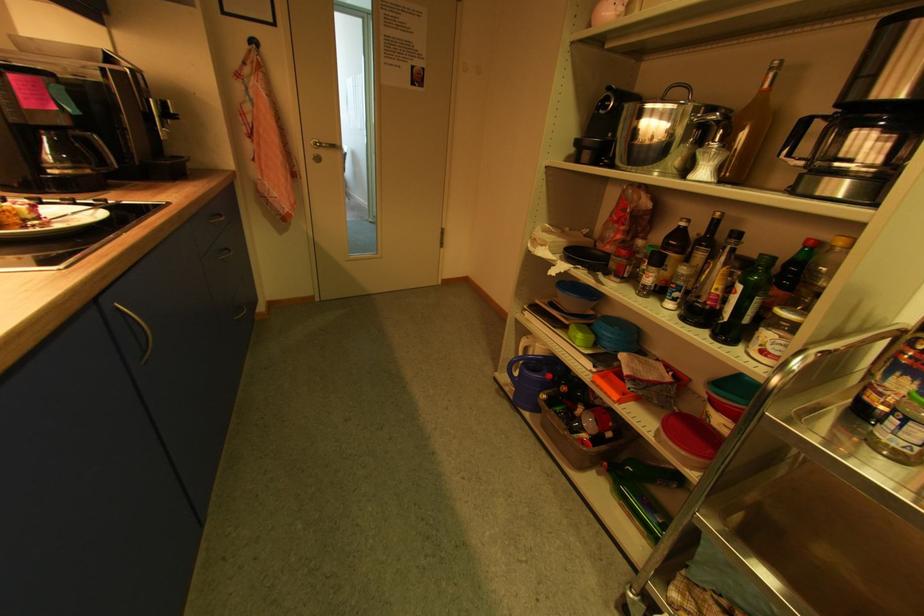
Where would you lift the coffee maker handle? Please return your answer as a coordinate pair (x, y).

(96, 151)